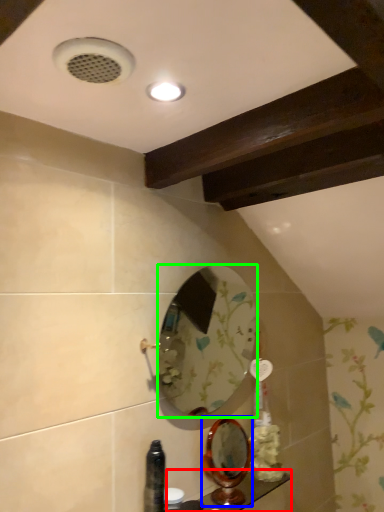
Question: Which object is positioned farthest from counter top (highlighted by a red box)? Select from mirror (highlighted by a blue box) and mirror (highlighted by a green box).

Choices:
 (A) mirror
 (B) mirror

Answer: (B)